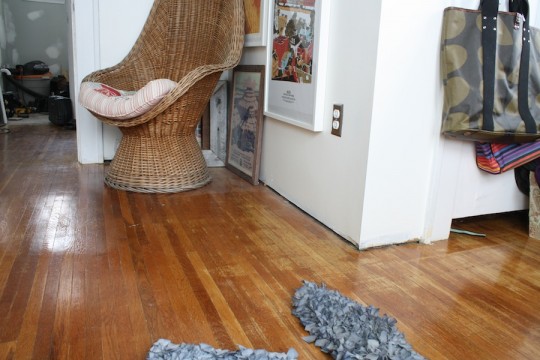
I want to click on white wall, so click(345, 65), click(120, 27), click(408, 67).